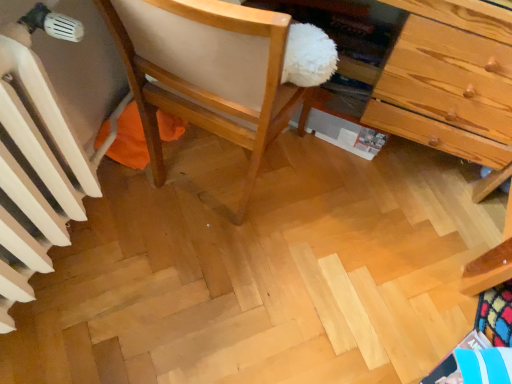
Question: Based on their sizes in the image, would you say wooden chair at center is bigger or smaller than white painted radiator at left?

Choices:
 (A) big
 (B) small

Answer: (A)

Question: Is wooden chair at center taller or shorter than white painted radiator at left?

Choices:
 (A) tall
 (B) short

Answer: (A)

Question: From a real-world perspective, is wooden chair at center positioned above or below white painted radiator at left?

Choices:
 (A) above
 (B) below

Answer: (A)

Question: From a real-world perspective, is white painted radiator at left positioned above or below wooden chair at center?

Choices:
 (A) above
 (B) below

Answer: (B)

Question: Looking at their shapes, would you say white painted radiator at left is wider or thinner than wooden chair at center?

Choices:
 (A) wide
 (B) thin

Answer: (B)

Question: From the image's perspective, is white painted radiator at left positioned above or below wooden chair at center?

Choices:
 (A) above
 (B) below

Answer: (B)

Question: Based on their positions, is white painted radiator at left located to the left or right of wooden chair at center?

Choices:
 (A) left
 (B) right

Answer: (A)